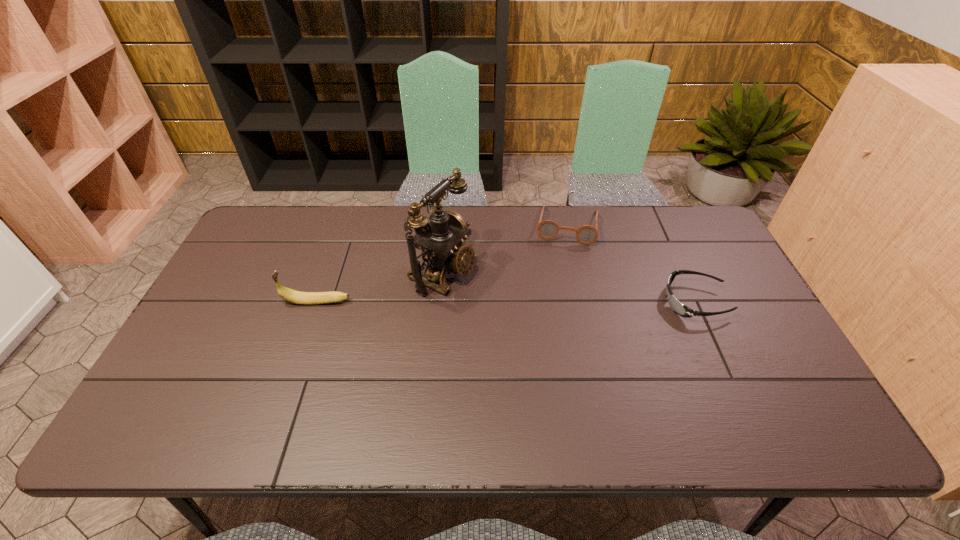
You are a GUI agent. You are given a task and a screenshot of the screen. Output one action in this format:
    pyautogui.click(x=<x>, y=<y>)
    Task: Click on the spectacles that is positioned at the far edge
    
    Given the screenshot: What is the action you would take?
    pyautogui.click(x=547, y=229)

Where is `object that is positioned at the right edge`? Image resolution: width=960 pixels, height=540 pixels. object that is positioned at the right edge is located at coordinates (680, 309).

In the image, there is a desktop. Where is `blank space at the far edge`? The height and width of the screenshot is (540, 960). blank space at the far edge is located at coordinates (519, 224).

You are a GUI agent. You are given a task and a screenshot of the screen. Output one action in this format:
    pyautogui.click(x=<x>, y=<y>)
    Task: Click on the vacant space at the near edge of the desktop
    Image resolution: width=960 pixels, height=540 pixels.
    Given the screenshot: What is the action you would take?
    pyautogui.click(x=414, y=388)

In the image, there is a desktop. Where is `vacant space at the left edge`? This screenshot has width=960, height=540. vacant space at the left edge is located at coordinates (253, 288).

Where is `free space at the right edge of the desktop`? This screenshot has height=540, width=960. free space at the right edge of the desktop is located at coordinates (789, 369).

I want to click on vacant space at the far right corner, so click(689, 248).

This screenshot has width=960, height=540. Identify the location of blank region between the telephone and the banana. (380, 287).

Where is `free space that is in between the telephone and the banana`? The height and width of the screenshot is (540, 960). free space that is in between the telephone and the banana is located at coordinates (380, 287).

Locate an element on the screen. vacant space that is in between the leftmost object and the shortest object is located at coordinates (506, 302).